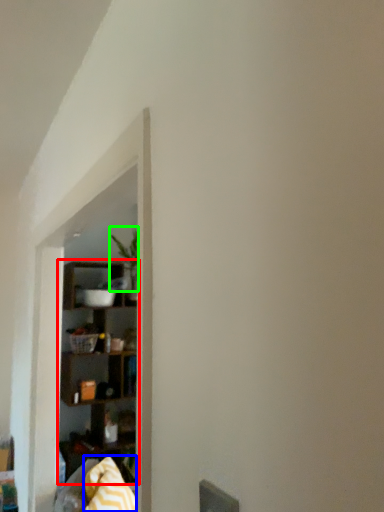
Question: Which object is positioned farthest from shelf (highlighted by a red box)? Select from blanket (highlighted by a blue box) and plant (highlighted by a green box).

Choices:
 (A) blanket
 (B) plant

Answer: (A)